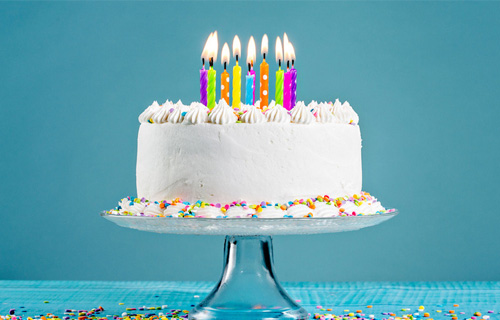
Identify the location of birthday candle. (199, 83), (208, 91), (224, 88), (234, 90), (247, 90), (254, 81), (264, 81), (275, 84), (285, 91), (292, 89).